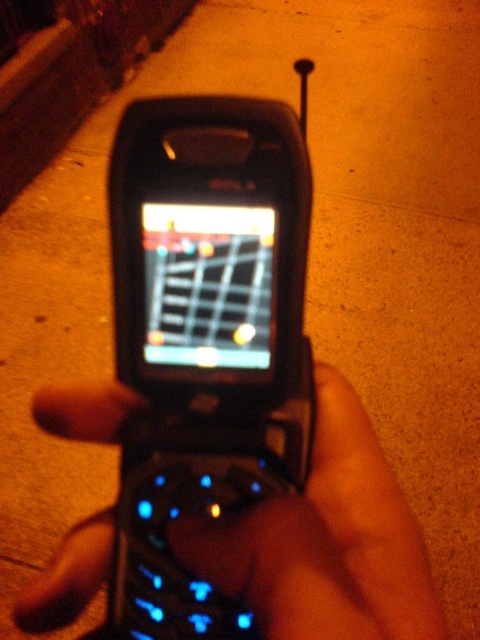
Question: Is black matte phone at center to the right of concrete at upper left from the viewer's perspective?

Choices:
 (A) no
 (B) yes

Answer: (B)

Question: Among these points, which one is farthest from the camera?

Choices:
 (A) (345, 593)
 (B) (176, 20)

Answer: (B)

Question: From the image, what is the correct spatial relationship of black matte phone at center in relation to concrete at upper left?

Choices:
 (A) above
 (B) below

Answer: (B)

Question: Which of the following is the closest to the observer?

Choices:
 (A) black matte phone at center
 (B) concrete at upper left

Answer: (A)

Question: Among these points, which one is farthest from the camera?

Choices:
 (A) (357, 611)
 (B) (0, 77)

Answer: (B)

Question: Can you confirm if black matte phone at center is positioned below concrete at upper left?

Choices:
 (A) yes
 (B) no

Answer: (A)